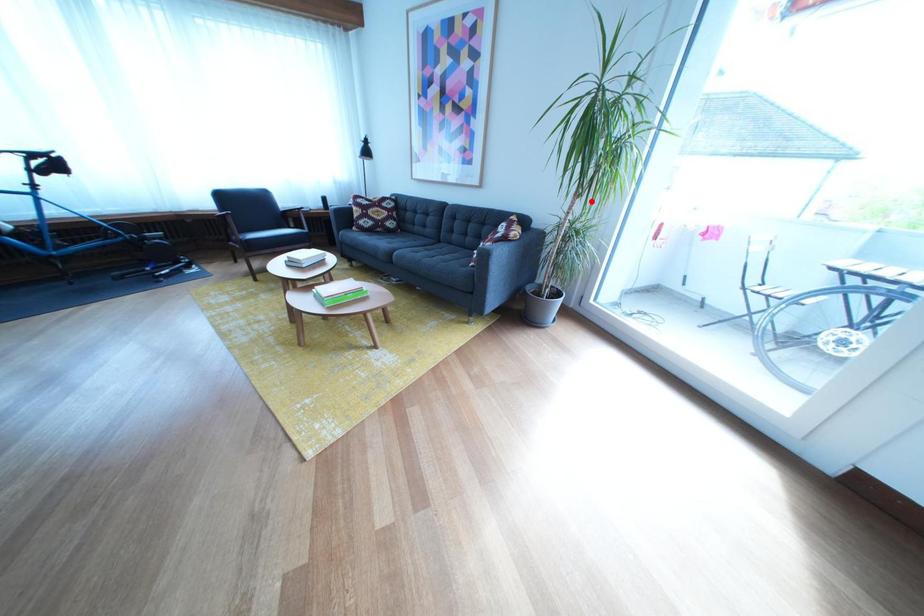
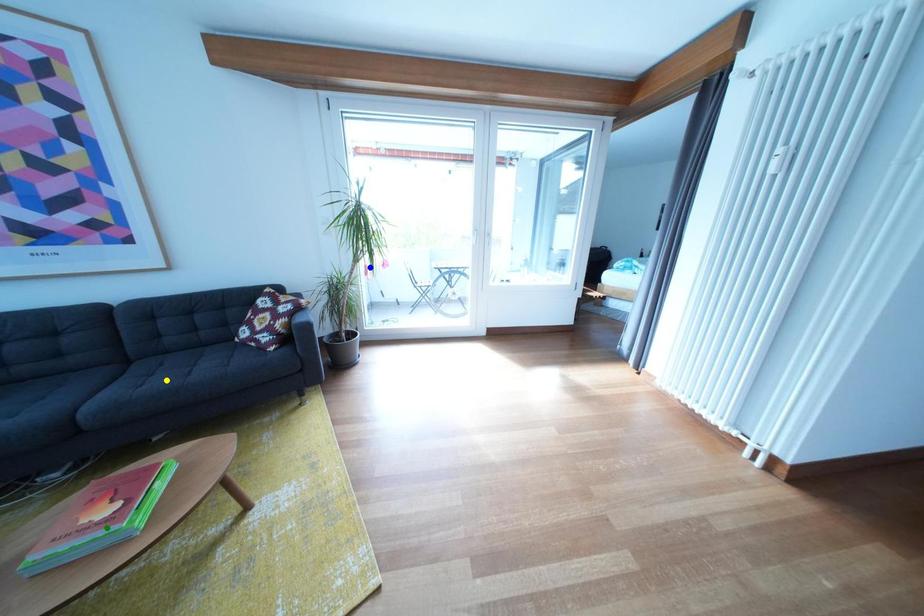
Question: I am providing you with two images of the same scene from different viewpoints. A red point is marked on the first image. You are given multiple points on the second image. Which point in image 2 represents the same 3d spot as the red point in image 1?

Choices:
 (A) green point
 (B) blue point
 (C) yellow point

Answer: (B)